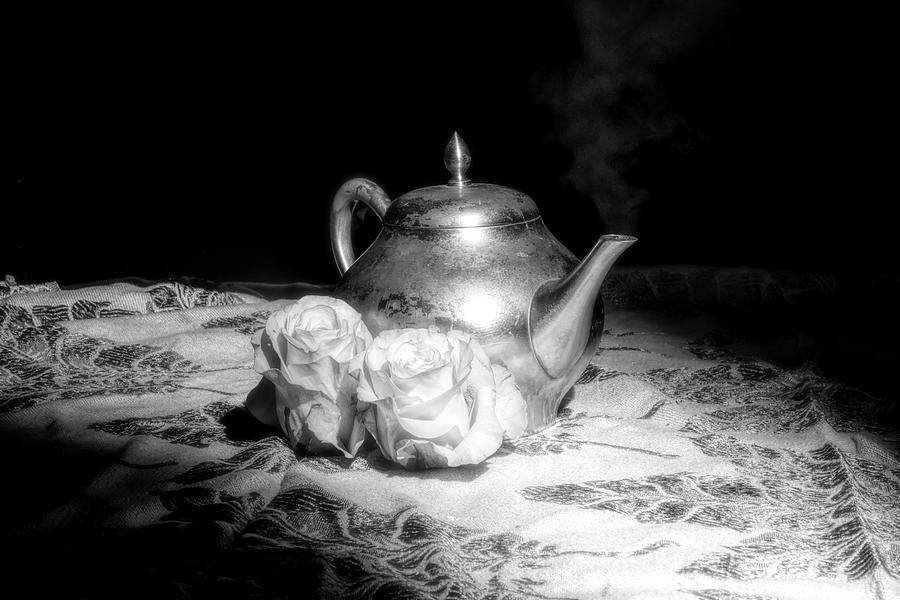
Identify the location of steel tea kettle. The image size is (900, 600). (486, 271).